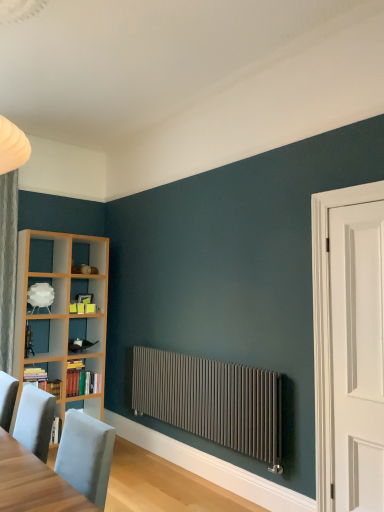
Question: Can you confirm if matte gray radiator at center is wider than white matte lampshade at left?

Choices:
 (A) no
 (B) yes

Answer: (A)

Question: Is matte gray radiator at center outside white matte lampshade at left?

Choices:
 (A) yes
 (B) no

Answer: (A)

Question: Is matte gray radiator at center aimed at white matte lampshade at left?

Choices:
 (A) yes
 (B) no

Answer: (B)

Question: Can you confirm if matte gray radiator at center is shorter than white matte lampshade at left?

Choices:
 (A) yes
 (B) no

Answer: (B)

Question: Is matte gray radiator at center bigger than white matte lampshade at left?

Choices:
 (A) yes
 (B) no

Answer: (A)

Question: Based on their sizes in the image, would you say light gray wood table at lower left is bigger or smaller than hardcover book at left, acting as the 2th book starting from the back?

Choices:
 (A) small
 (B) big

Answer: (B)

Question: From a real-world perspective, is light gray wood table at lower left above or below hardcover book at left, acting as the 2th book starting from the back?

Choices:
 (A) below
 (B) above

Answer: (B)

Question: In the image, is light gray wood table at lower left on the left side or the right side of hardcover book at left, acting as the 2th book starting from the back?

Choices:
 (A) left
 (B) right

Answer: (B)

Question: Considering the positions of light gray wood table at lower left and hardcover book at left, acting as the 2th book starting from the back, in the image, is light gray wood table at lower left taller or shorter than hardcover book at left, acting as the 2th book starting from the back,?

Choices:
 (A) short
 (B) tall

Answer: (B)

Question: In the image, is matte gray radiator at center positioned in front of or behind hardcover book at left, acting as the 2th book starting from the back?

Choices:
 (A) front
 (B) behind

Answer: (A)

Question: Is matte gray radiator at center taller or shorter than hardcover book at left, acting as the 2th book starting from the back?

Choices:
 (A) short
 (B) tall

Answer: (B)

Question: Is matte gray radiator at center to the left or to the right of hardcover book at left, acting as the 2th book starting from the back, in the image?

Choices:
 (A) right
 (B) left

Answer: (A)

Question: Based on their sizes in the image, would you say matte gray radiator at center is bigger or smaller than hardcover book at left, which is the first book from front to back?

Choices:
 (A) small
 (B) big

Answer: (B)

Question: Is hardcover books at left, which is the 1th book in back-to-front order, in front of or behind matte gray radiator at center in the image?

Choices:
 (A) behind
 (B) front

Answer: (A)

Question: Looking at the image, does hardcover books at left, acting as the second book starting from the front, seem bigger or smaller compared to matte gray radiator at center?

Choices:
 (A) big
 (B) small

Answer: (B)